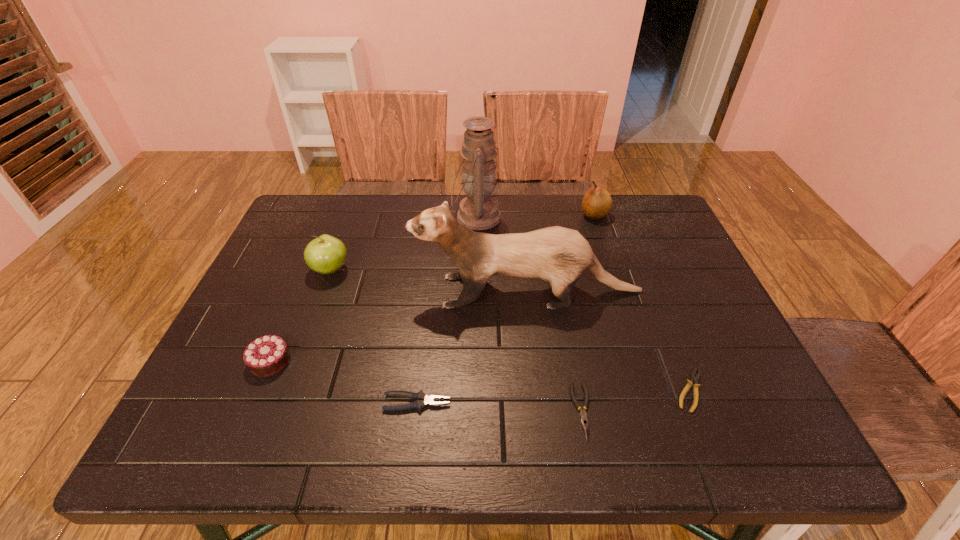
You are a GUI agent. You are given a task and a screenshot of the screen. Output one action in this format:
    pyautogui.click(x=<x>, y=<y>)
    Task: Click on the vacant space at the right edge
    
    Given the screenshot: What is the action you would take?
    pyautogui.click(x=684, y=251)

I want to click on vacant space at the far left corner of the desktop, so click(306, 235).

Identify the location of free space between the second shortest object and the pear. This screenshot has width=960, height=540. [x=588, y=313].

Find the location of a particular element. This screenshot has height=540, width=960. free space between the oil lamp and the tallest pliers is located at coordinates (446, 310).

Find the location of `free space between the tallest pliers and the seventh shortest object`. free space between the tallest pliers and the seventh shortest object is located at coordinates (472, 347).

The image size is (960, 540). I want to click on unoccupied position between the pear and the chocolate cake, so click(433, 288).

Image resolution: width=960 pixels, height=540 pixels. What are the coordinates of `free spot between the rightmost pliers and the sixth tallest object` in the screenshot? It's located at (554, 396).

Find the location of a particular element. unoccupied position between the ferret and the chocolate cake is located at coordinates (399, 326).

Identify the location of vacant point located between the sixth tallest object and the second shortest pliers. Image resolution: width=960 pixels, height=540 pixels. (499, 407).

Identify the location of unoccupied area between the shortest pliers and the sixth tallest object. Image resolution: width=960 pixels, height=540 pixels. (554, 396).